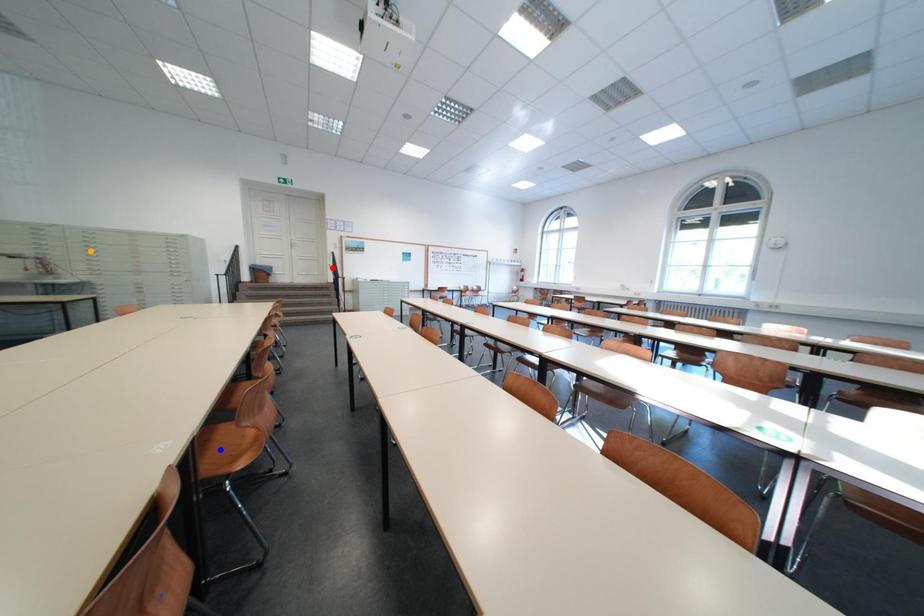
Order these from nearest to farthest:
- blue point
- orange point
- red point

1. blue point
2. orange point
3. red point